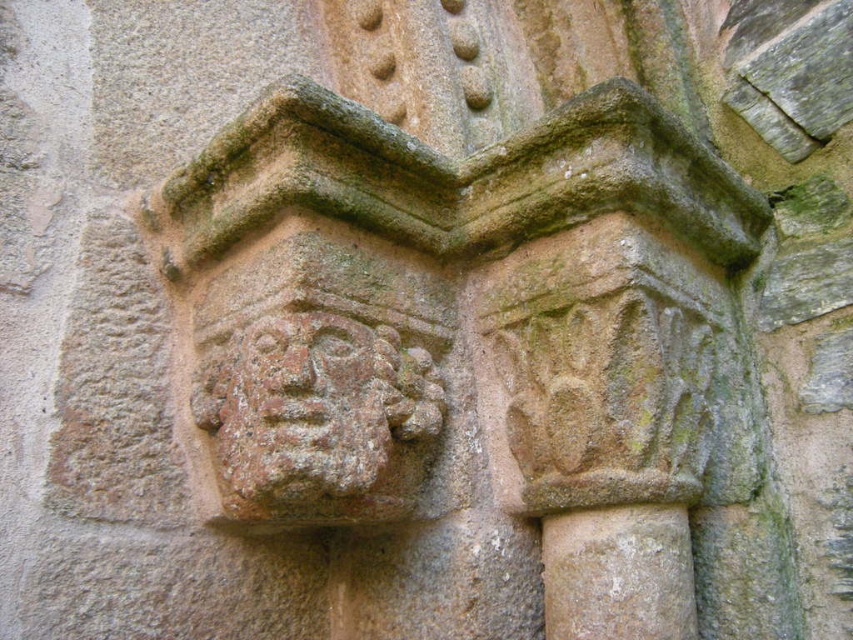
Consider the image. Who is taller, brown stone carving at center or rustic stone face at center?

With more height is brown stone carving at center.

Can you confirm if brown stone carving at center is bigger than rustic stone face at center?

Yes.

Between point (283, 86) and point (276, 464), which one is positioned in front?

Point (276, 464) is in front.

The height and width of the screenshot is (640, 853). Find the location of `brown stone carving at center`. brown stone carving at center is located at coordinates (465, 324).